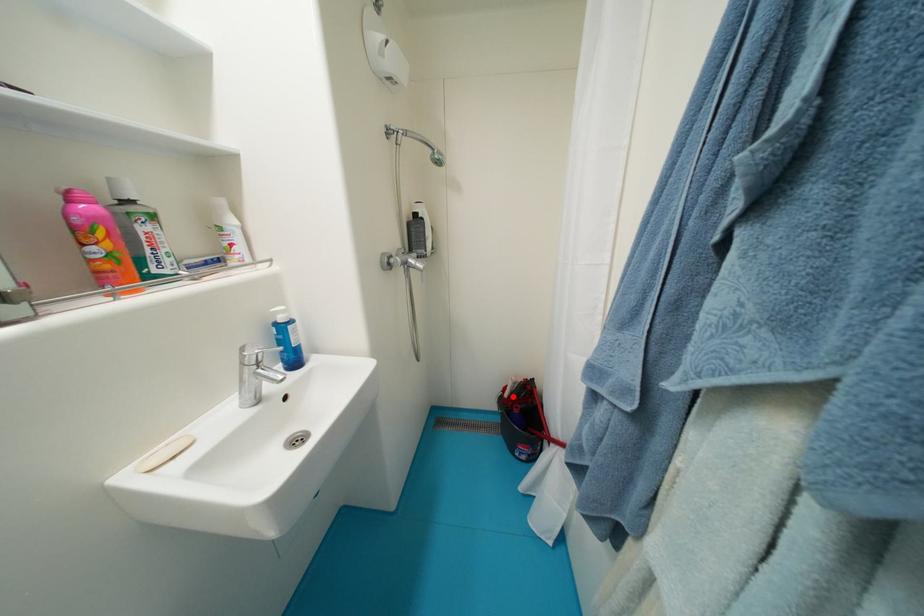
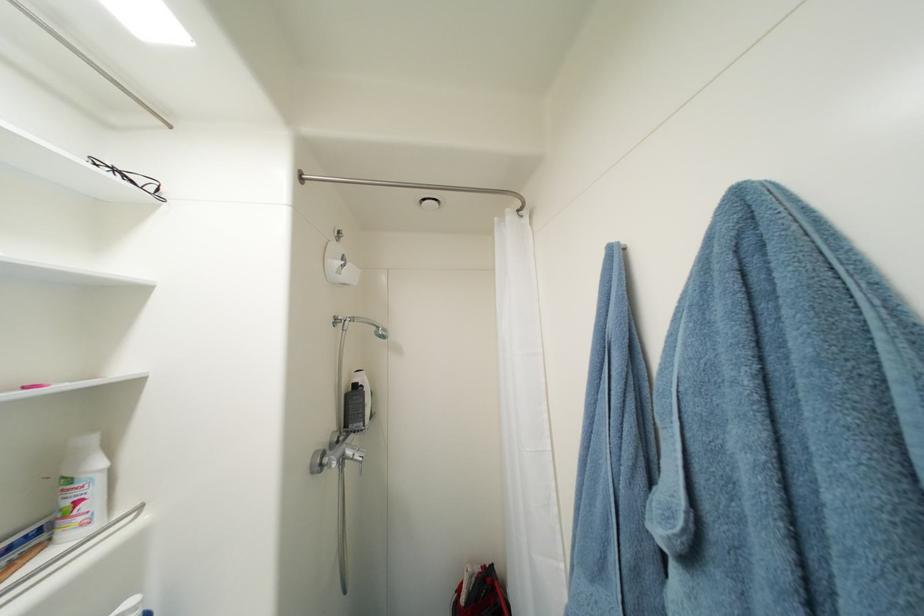
Where in the second image is the point corresponding to the highlighted location from the first image?

(469, 602)